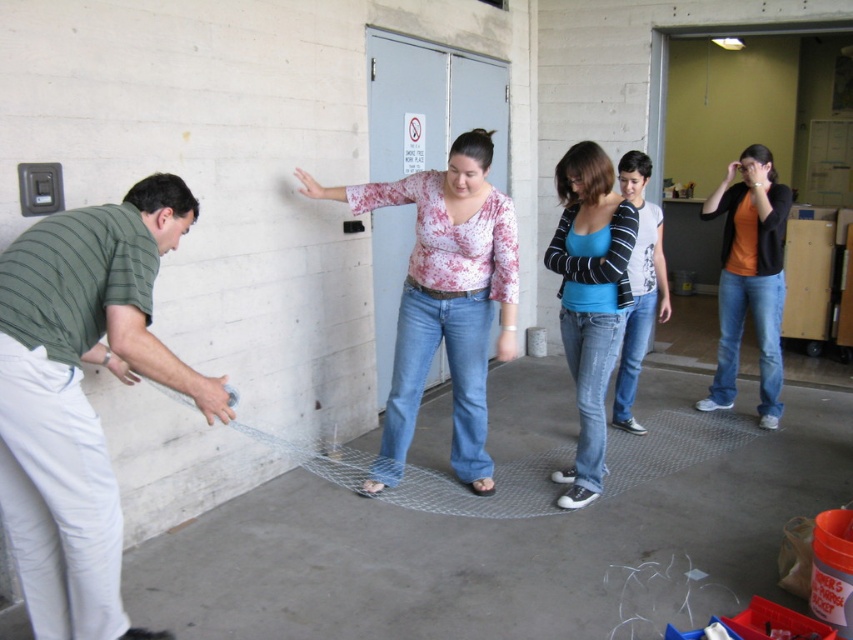
Can you confirm if green striped shirt at left is wider than floral print blouse at center?

Incorrect, green striped shirt at left's width does not surpass floral print blouse at center's.

From the picture: Is green striped shirt at left bigger than floral print blouse at center?

No, green striped shirt at left is not bigger than floral print blouse at center.

Does point (18, 429) come behind point (479, 321)?

No, (18, 429) is closer to viewer.

I want to click on green striped shirt at left, so click(x=80, y=396).

Who is shorter, floral print blouse at center or blue cotton shirt at center?

blue cotton shirt at center is shorter.

Looking at this image, does floral print blouse at center have a greater height compared to blue cotton shirt at center?

Correct, floral print blouse at center is much taller as blue cotton shirt at center.

Who is more distant from viewer, (448, 348) or (595, 464)?

The point (595, 464) is behind.

You are a GUI agent. You are given a task and a screenshot of the screen. Output one action in this format:
    pyautogui.click(x=<x>, y=<y>)
    Task: Click on the floral print blouse at center
    
    Given the screenshot: What is the action you would take?
    pyautogui.click(x=447, y=294)

Can you confirm if green striped shirt at left is shorter than blue cotton shirt at center?

Yes.

Is green striped shirt at left thinner than blue cotton shirt at center?

No.

The image size is (853, 640). Identify the location of green striped shirt at left. (80, 396).